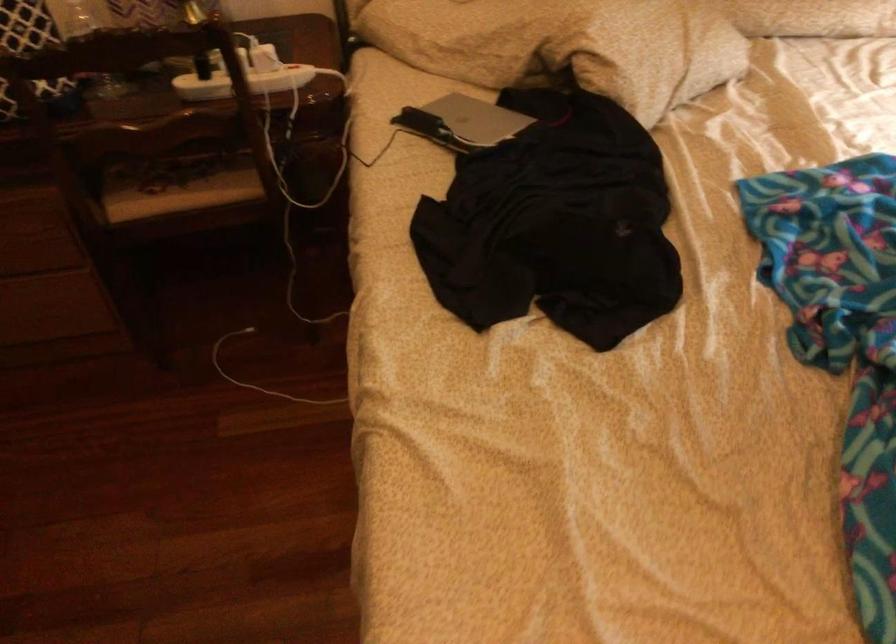
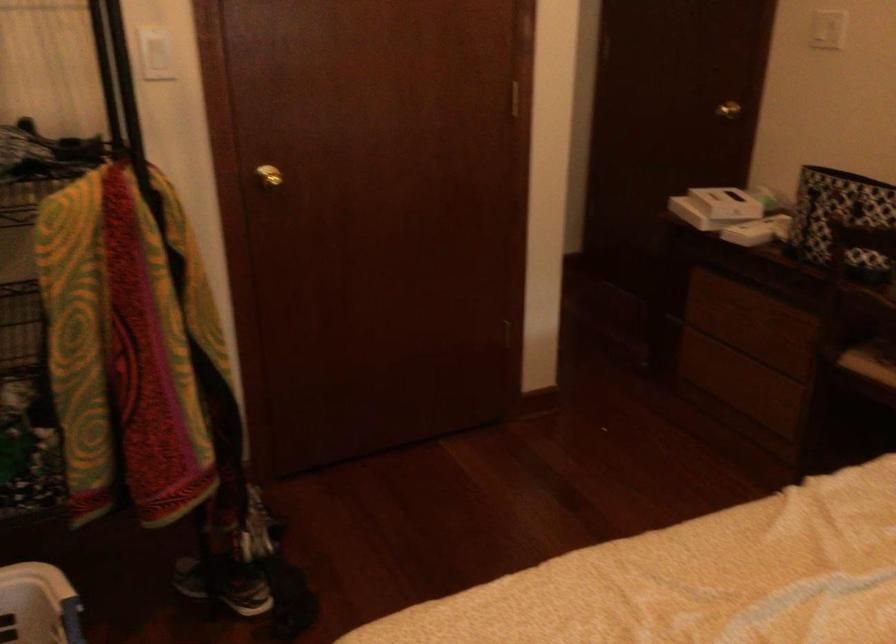
Question: The camera is either moving clockwise (left) or counter-clockwise (right) around the object. The first image is from the beginning of the video and the second image is from the end. Is the camera moving left or right when shooting the video?

Choices:
 (A) Left
 (B) Right

Answer: (B)